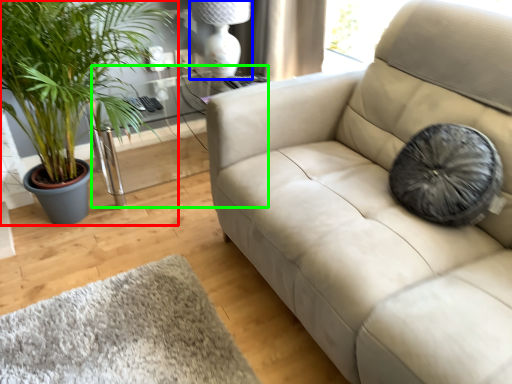
Question: Based on their relative distances, which object is farther from houseplant (highlighted by a red box)? Choose from lamp (highlighted by a blue box) and table (highlighted by a green box).

Choices:
 (A) lamp
 (B) table

Answer: (A)